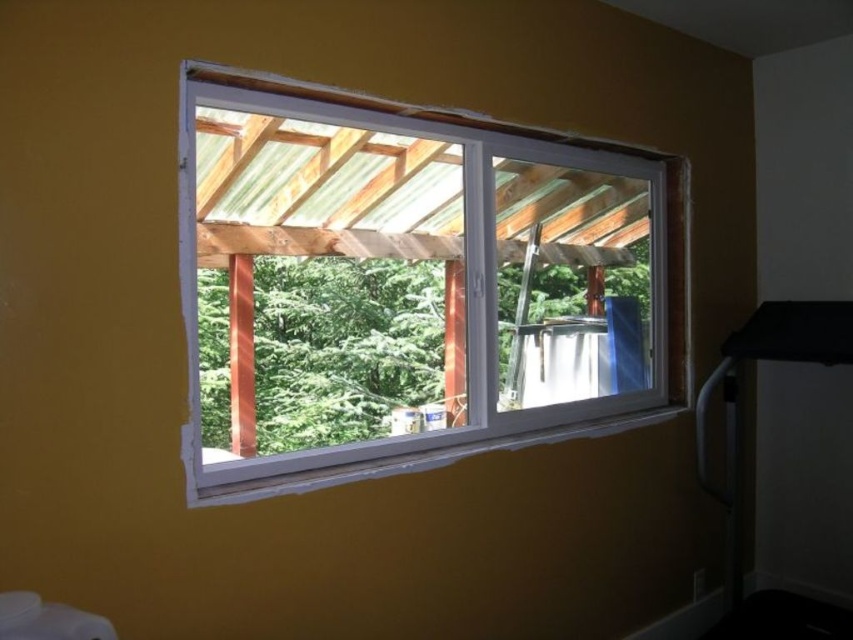
Question: Which point appears farthest from the camera in this image?

Choices:
 (A) (525, 131)
 (B) (619, 376)

Answer: (B)

Question: Which point appears farthest from the camera in this image?

Choices:
 (A) (625, 330)
 (B) (350, 136)

Answer: (A)

Question: Can you confirm if white plastic window at center is positioned above blue fabric curtain at right?

Choices:
 (A) no
 (B) yes

Answer: (B)

Question: Among these points, which one is nearest to the camera?

Choices:
 (A) pos(635,355)
 (B) pos(193,484)

Answer: (B)

Question: Can you confirm if white plastic window at center is thinner than blue fabric curtain at right?

Choices:
 (A) yes
 (B) no

Answer: (B)

Question: Does white plastic window at center have a smaller size compared to blue fabric curtain at right?

Choices:
 (A) yes
 (B) no

Answer: (B)